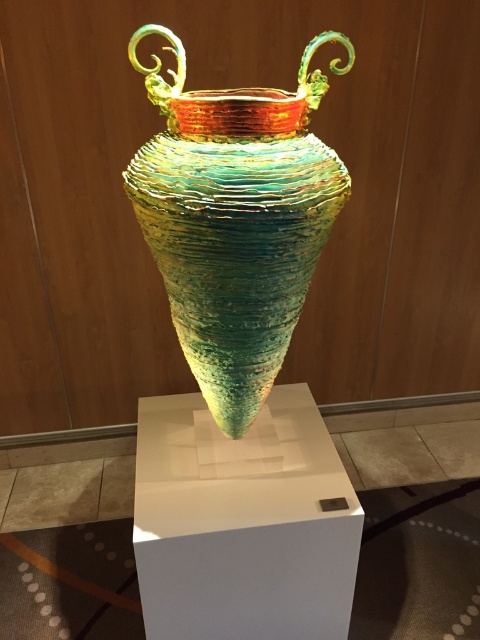
Who is lower down, translucent glass vase at center or white matte pedestal at center?

white matte pedestal at center

Is translucent glass vase at center to the left of white matte pedestal at center from the viewer's perspective?

Correct, you'll find translucent glass vase at center to the left of white matte pedestal at center.

Is point (264, 204) positioned in front of point (299, 531)?

Yes, it is in front of point (299, 531).

You are a GUI agent. You are given a task and a screenshot of the screen. Output one action in this format:
    pyautogui.click(x=<x>, y=<y>)
    Task: Click on the translucent glass vase at center
    The height and width of the screenshot is (640, 480).
    Given the screenshot: What is the action you would take?
    pyautogui.click(x=236, y=220)